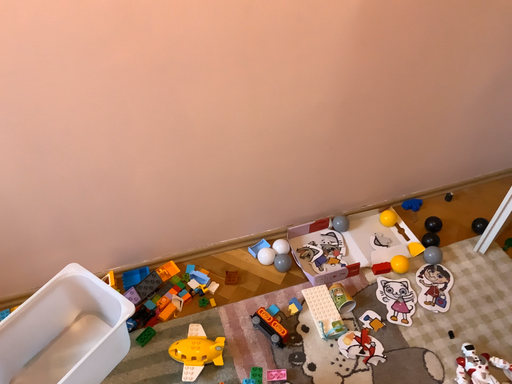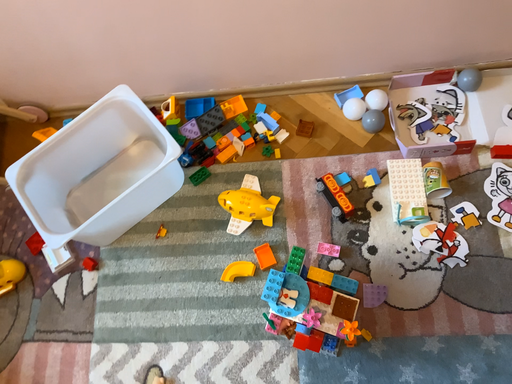
Question: Which way did the camera rotate in the video?

Choices:
 (A) rotated upward
 (B) rotated downward

Answer: (B)